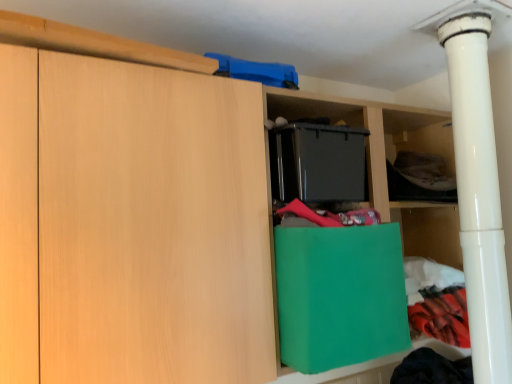
Question: Are green paper bag at center and white glossy pipe at right located far from each other?

Choices:
 (A) no
 (B) yes

Answer: (A)

Question: Is green paper bag at center smaller than white glossy pipe at right?

Choices:
 (A) no
 (B) yes

Answer: (A)

Question: Would you say green paper bag at center is outside white glossy pipe at right?

Choices:
 (A) yes
 (B) no

Answer: (A)

Question: Is white glossy pipe at right inside green paper bag at center?

Choices:
 (A) yes
 (B) no

Answer: (B)

Question: Does green paper bag at center touch white glossy pipe at right?

Choices:
 (A) no
 (B) yes

Answer: (A)

Question: From a real-world perspective, does green paper bag at center sit lower than white glossy pipe at right?

Choices:
 (A) yes
 (B) no

Answer: (A)

Question: Is white glossy pipe at right far away from dark gray fabric at upper right?

Choices:
 (A) yes
 (B) no

Answer: (B)

Question: Is white glossy pipe at right wider than dark gray fabric at upper right?

Choices:
 (A) no
 (B) yes

Answer: (B)

Question: Considering the relative positions of white glossy pipe at right and dark gray fabric at upper right in the image provided, is white glossy pipe at right to the left of dark gray fabric at upper right from the viewer's perspective?

Choices:
 (A) no
 (B) yes

Answer: (A)

Question: Is white glossy pipe at right at the right side of dark gray fabric at upper right?

Choices:
 (A) yes
 (B) no

Answer: (A)

Question: Is dark gray fabric at upper right located within white glossy pipe at right?

Choices:
 (A) yes
 (B) no

Answer: (B)

Question: From the image's perspective, is white glossy pipe at right under dark gray fabric at upper right?

Choices:
 (A) yes
 (B) no

Answer: (A)

Question: Is dark gray fabric at upper right at the right side of white glossy pipe at right?

Choices:
 (A) no
 (B) yes

Answer: (A)